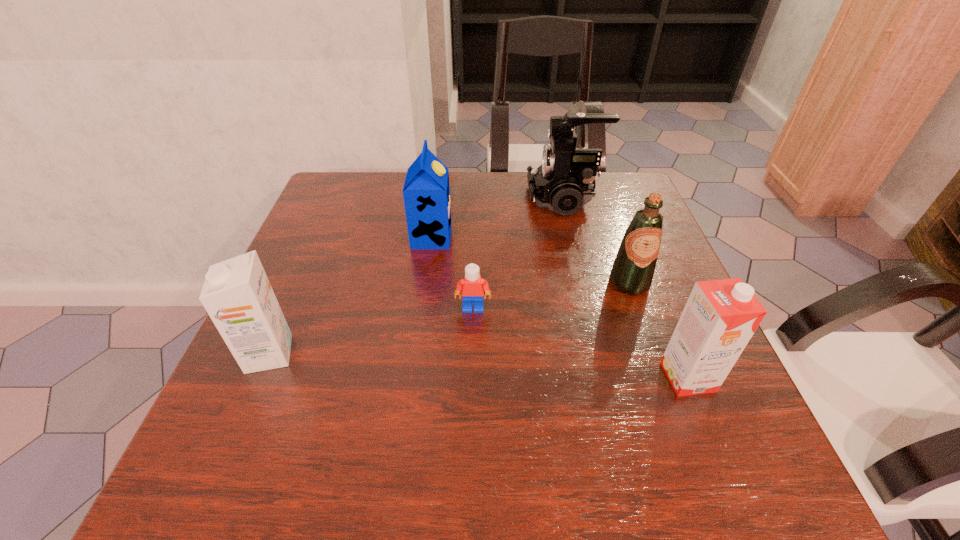
This screenshot has width=960, height=540. In order to click on vacant space that's between the fourth nearest object and the leftmost object in this screenshot , I will do `click(449, 318)`.

What are the coordinates of `vacant space that's between the olive oil and the rightmost carton` in the screenshot? It's located at (659, 330).

The width and height of the screenshot is (960, 540). In order to click on vacant region between the third object from left to right and the leftmost object in this screenshot , I will do `click(371, 331)`.

Find the location of a particular element. This screenshot has width=960, height=540. free space between the fourth nearest object and the rightmost carton is located at coordinates (659, 330).

At what (x,y) coordinates should I click in order to perform the action: click on vacant space that's between the olive oil and the leftmost carton. Please return your answer as a coordinate pair (x, y). Image resolution: width=960 pixels, height=540 pixels. Looking at the image, I should click on tap(449, 318).

At what (x,y) coordinates should I click in order to perform the action: click on free space between the farthest object and the shortest object. Please return your answer as a coordinate pair (x, y). This screenshot has height=540, width=960. Looking at the image, I should click on (518, 254).

The image size is (960, 540). In order to click on vacant space that's between the olive oil and the third nearest object in this screenshot , I will do `click(551, 295)`.

The height and width of the screenshot is (540, 960). I want to click on empty space between the farthest object and the olive oil, so click(x=597, y=241).

Find the location of `free space between the leftmost carton and the Lego`. free space between the leftmost carton and the Lego is located at coordinates (371, 331).

The height and width of the screenshot is (540, 960). In order to click on object that is the third nearest to the second object from left to right in this screenshot , I will do click(x=237, y=295).